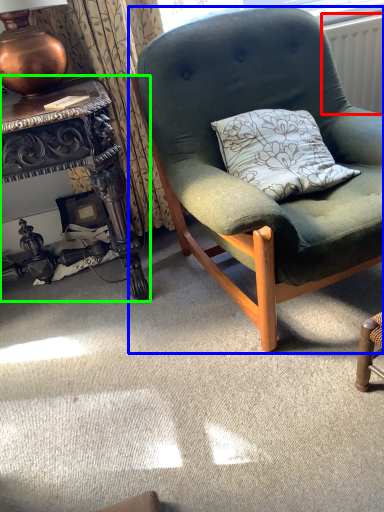
Question: Estimate the real-world distances between objects in this image. Which object is closer to radiator (highlighted by a red box), chair (highlighted by a blue box) or desk (highlighted by a green box)?

Choices:
 (A) chair
 (B) desk

Answer: (A)